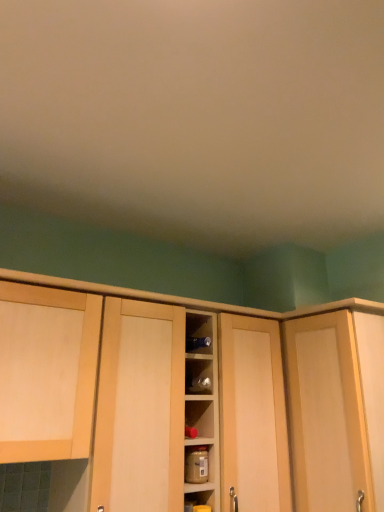
Image resolution: width=384 pixels, height=512 pixels. What do you see at coordinates (62, 369) in the screenshot?
I see `light wood cabinet at left, the 2th cabinetry positioned from the right` at bounding box center [62, 369].

Find the location of a particular element. This screenshot has height=512, width=384. light wood cabinet at left, the 2th cabinetry positioned from the right is located at coordinates (62, 369).

Describe the element at coordinates (326, 414) in the screenshot. I see `light wood cabinet door at right` at that location.

Identify the location of light wood cabinet at left, acting as the first cabinetry starting from the left. The height and width of the screenshot is (512, 384). (62, 369).

From a real-world perspective, relative to light wood cabinet at left, the 2th cabinetry positioned from the right, is wooden cabinet at center, the 2th cabinetry positioned from the left, vertically above or below?

Clearly, from a real-world perspective, wooden cabinet at center, the 2th cabinetry positioned from the left, is below light wood cabinet at left, the 2th cabinetry positioned from the right.

Considering the relative positions of wooden cabinet at center, marked as the 1th cabinetry in a right-to-left arrangement, and light wood cabinet at left, acting as the first cabinetry starting from the left, in the image provided, is wooden cabinet at center, marked as the 1th cabinetry in a right-to-left arrangement, in front of light wood cabinet at left, acting as the first cabinetry starting from the left,?

That is False.

Is wooden cabinet at center, marked as the 1th cabinetry in a right-to-left arrangement, turned away from light wood cabinet at left, the 2th cabinetry positioned from the right?

That's not correct — wooden cabinet at center, marked as the 1th cabinetry in a right-to-left arrangement, is not looking away from light wood cabinet at left, the 2th cabinetry positioned from the right.

Where is `cabinetry above the wooden cabinet at center, the 2th cabinetry positioned from the left (from a real-world perspective)`? cabinetry above the wooden cabinet at center, the 2th cabinetry positioned from the left (from a real-world perspective) is located at coordinates (62, 369).

Which object is positioned more to the left, wooden cabinet at center, the 2th cabinetry positioned from the left, or light wood cabinet door at right?

wooden cabinet at center, the 2th cabinetry positioned from the left, is more to the left.

Is wooden cabinet at center, marked as the 1th cabinetry in a right-to-left arrangement, bigger or smaller than light wood cabinet door at right?

Considering their sizes, wooden cabinet at center, marked as the 1th cabinetry in a right-to-left arrangement, takes up more space than light wood cabinet door at right.

Considering the sizes of objects wooden cabinet at center, marked as the 1th cabinetry in a right-to-left arrangement, and light wood cabinet door at right in the image provided, who is taller, wooden cabinet at center, marked as the 1th cabinetry in a right-to-left arrangement, or light wood cabinet door at right?

wooden cabinet at center, marked as the 1th cabinetry in a right-to-left arrangement, is taller.

In the scene shown: Which is closer, [78,290] or [347,477]?

Point [78,290] is closer to the camera than point [347,477].

Is wooden cabinet at center, the 2th cabinetry positioned from the left, facing away from brown matte jar at center?

Yes, wooden cabinet at center, the 2th cabinetry positioned from the left,'s orientation is away from brown matte jar at center.

From a real-world perspective, which object stands above the other?

From a 3D spatial view, wooden cabinet at center, marked as the 1th cabinetry in a right-to-left arrangement, is above.

Does light wood cabinet door at right lie in front of brown matte jar at center?

Yes, light wood cabinet door at right is in front of brown matte jar at center.

Are light wood cabinet door at right and brown matte jar at center beside each other?

light wood cabinet door at right is not next to brown matte jar at center, and they're not touching.

Is point (305, 431) closer to viewer compared to point (207, 446)?

No.

In the scene shown: Measure the distance from light wood cabinet door at right to brown matte jar at center.

A distance of 17.05 inches exists between light wood cabinet door at right and brown matte jar at center.

Is light wood cabinet door at right aimed at wooden cabinet at center, the 2th cabinetry positioned from the left?

No, light wood cabinet door at right is not aimed at wooden cabinet at center, the 2th cabinetry positioned from the left.

Would you consider light wood cabinet door at right to be distant from wooden cabinet at center, the 2th cabinetry positioned from the left?

light wood cabinet door at right is actually quite close to wooden cabinet at center, the 2th cabinetry positioned from the left.

I want to click on door located below the wooden cabinet at center, marked as the 1th cabinetry in a right-to-left arrangement (from the image's perspective), so click(x=326, y=414).

Is light wood cabinet door at right thinner than wooden cabinet at center, the 2th cabinetry positioned from the left?

Correct, the width of light wood cabinet door at right is less than that of wooden cabinet at center, the 2th cabinetry positioned from the left.

Which is in front, point (50, 390) or point (333, 425)?

The point (50, 390) is more forward.

Is light wood cabinet door at right completely or partially inside light wood cabinet at left, acting as the first cabinetry starting from the left?

No, light wood cabinet door at right is not a part of light wood cabinet at left, acting as the first cabinetry starting from the left.

Is light wood cabinet door at right directly adjacent to light wood cabinet at left, the 2th cabinetry positioned from the right?

light wood cabinet door at right and light wood cabinet at left, the 2th cabinetry positioned from the right, are clearly separated.

Is light wood cabinet door at right oriented towards light wood cabinet at left, acting as the first cabinetry starting from the left?

Yes, light wood cabinet door at right is turned towards light wood cabinet at left, acting as the first cabinetry starting from the left.

Who is taller, light wood cabinet door at right or light wood cabinet at left, the 2th cabinetry positioned from the right?

Standing taller between the two is light wood cabinet door at right.

From a real-world perspective, which is physically above, light wood cabinet door at right or light wood cabinet at left, acting as the first cabinetry starting from the left?

light wood cabinet at left, acting as the first cabinetry starting from the left, from a real-world perspective.

What are the coordinates of `cabinetry that is below the light wood cabinet at left, acting as the first cabinetry starting from the left (from the image's perspective)` in the screenshot? It's located at (263, 317).

Find the location of a particular element. This screenshot has height=512, width=384. the 1st cabinetry above when counting from the light wood cabinet door at right (from the image's perspective) is located at coordinates (263, 317).

Which object lies nearer to the anchor point light wood cabinet door at right, light wood cabinet at left, acting as the first cabinetry starting from the left, or wooden cabinet at center, marked as the 1th cabinetry in a right-to-left arrangement?

Based on the image, wooden cabinet at center, marked as the 1th cabinetry in a right-to-left arrangement, appears to be nearer to light wood cabinet door at right.

Estimate the real-world distances between objects in this image. Which object is closer to brown matte jar at center, light wood cabinet at left, acting as the first cabinetry starting from the left, or wooden cabinet at center, the 2th cabinetry positioned from the left?

light wood cabinet at left, acting as the first cabinetry starting from the left, is closer to brown matte jar at center.

Estimate the real-world distances between objects in this image. Which object is closer to brown matte jar at center, light wood cabinet door at right or light wood cabinet at left, the 2th cabinetry positioned from the right?

light wood cabinet door at right is positioned closer to the anchor brown matte jar at center.

When comparing their distances from brown matte jar at center, does light wood cabinet door at right or wooden cabinet at center, marked as the 1th cabinetry in a right-to-left arrangement, seem closer?

Based on the image, light wood cabinet door at right appears to be nearer to brown matte jar at center.

Estimate the real-world distances between objects in this image. Which object is further from light wood cabinet at left, the 2th cabinetry positioned from the right, wooden cabinet at center, the 2th cabinetry positioned from the left, or light wood cabinet door at right?

The object further to light wood cabinet at left, the 2th cabinetry positioned from the right, is light wood cabinet door at right.

Estimate the real-world distances between objects in this image. Which object is further from wooden cabinet at center, marked as the 1th cabinetry in a right-to-left arrangement, light wood cabinet at left, acting as the first cabinetry starting from the left, or light wood cabinet door at right?

light wood cabinet at left, acting as the first cabinetry starting from the left, is further to wooden cabinet at center, marked as the 1th cabinetry in a right-to-left arrangement.

Considering their positions, is light wood cabinet at left, acting as the first cabinetry starting from the left, positioned further to brown matte jar at center than light wood cabinet door at right?

Based on the image, light wood cabinet at left, acting as the first cabinetry starting from the left, appears to be further to brown matte jar at center.

Estimate the real-world distances between objects in this image. Which object is closer to light wood cabinet at left, acting as the first cabinetry starting from the left, light wood cabinet door at right or wooden cabinet at center, the 2th cabinetry positioned from the left?

wooden cabinet at center, the 2th cabinetry positioned from the left, is closer to light wood cabinet at left, acting as the first cabinetry starting from the left.

At what (x,y) coordinates should I click in order to perform the action: click on cabinetry situated between light wood cabinet at left, the 2th cabinetry positioned from the right, and light wood cabinet door at right from left to right. Please return your answer as a coordinate pair (x, y). The image size is (384, 512). Looking at the image, I should click on (263, 317).

Locate an element on the screen. The height and width of the screenshot is (512, 384). shelf between wooden cabinet at center, marked as the 1th cabinetry in a right-to-left arrangement, and light wood cabinet door at right is located at coordinates (199, 466).

I want to click on shelf situated between light wood cabinet at left, the 2th cabinetry positioned from the right, and light wood cabinet door at right from left to right, so click(199, 466).

Where is `cabinetry situated between light wood cabinet at left, acting as the first cabinetry starting from the left, and brown matte jar at center from left to right`? cabinetry situated between light wood cabinet at left, acting as the first cabinetry starting from the left, and brown matte jar at center from left to right is located at coordinates (263, 317).